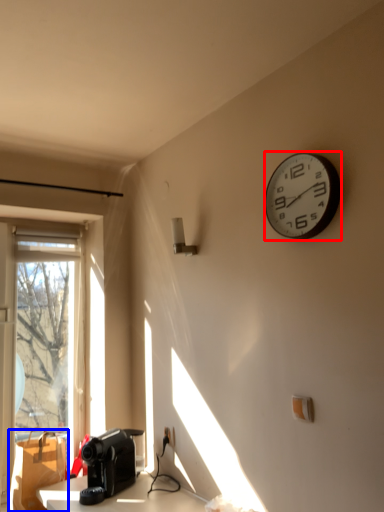
Question: Which object appears farthest to the camera in this image, wall clock (highlighted by a red box) or cardboard box (highlighted by a blue box)?

Choices:
 (A) wall clock
 (B) cardboard box

Answer: (B)